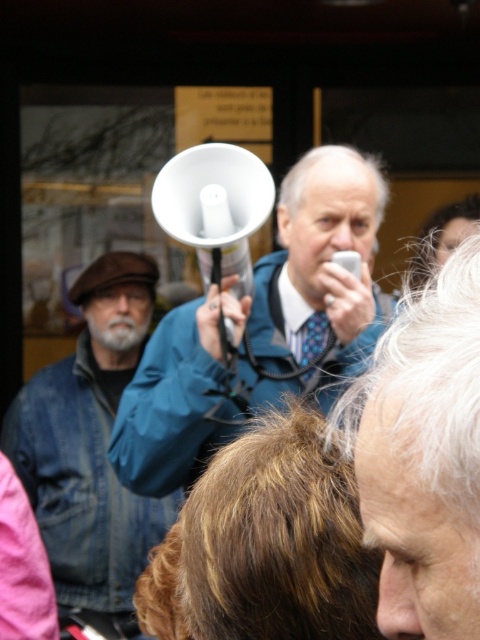
Is point (145, 348) in front of point (477, 394)?

No, (145, 348) is further to viewer.

Which is above, white plastic megaphone at center or smooth blue jacket at center?

white plastic megaphone at center is above.

At what (x,y) coordinates should I click in order to perform the action: click on white plastic megaphone at center. Please return your answer as a coordinate pair (x, y). Looking at the image, I should click on (313, 282).

Is smooth blue jacket at center positioned at the back of denim jacket at left?

No, smooth blue jacket at center is in front of denim jacket at left.

Does point (419, 292) come behind point (27, 433)?

No, it is not.

I want to click on smooth blue jacket at center, so click(x=422, y=456).

Who is positioned more to the right, white plastic megaphone at center or denim jacket at left?

Result: white plastic megaphone at center

Does white plastic megaphone at center appear on the left side of denim jacket at left?

In fact, white plastic megaphone at center is to the right of denim jacket at left.

The image size is (480, 640). I want to click on white plastic megaphone at center, so coord(313,282).